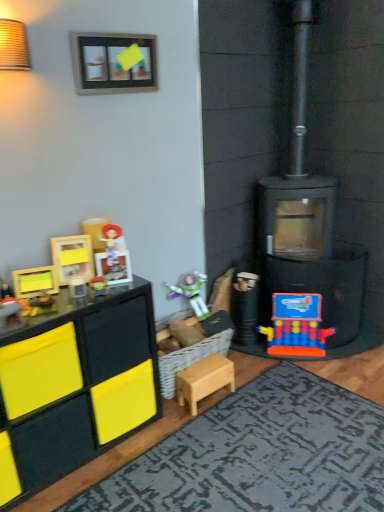
Identify the location of vacant space to the right of orange plastic toy at lower right, arranged as the first toy when viewed from the back. The height and width of the screenshot is (512, 384). (356, 358).